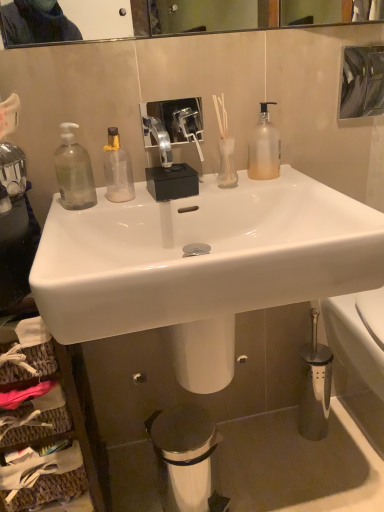
You are a GUI agent. You are given a task and a screenshot of the screen. Output one action in this format:
    pyautogui.click(x=<x>, y=<y>)
    Task: Click on the vacant area located to the right-hand side of metallic trash can at lower center
    This screenshot has width=384, height=512.
    Given the screenshot: What is the action you would take?
    pyautogui.click(x=253, y=476)